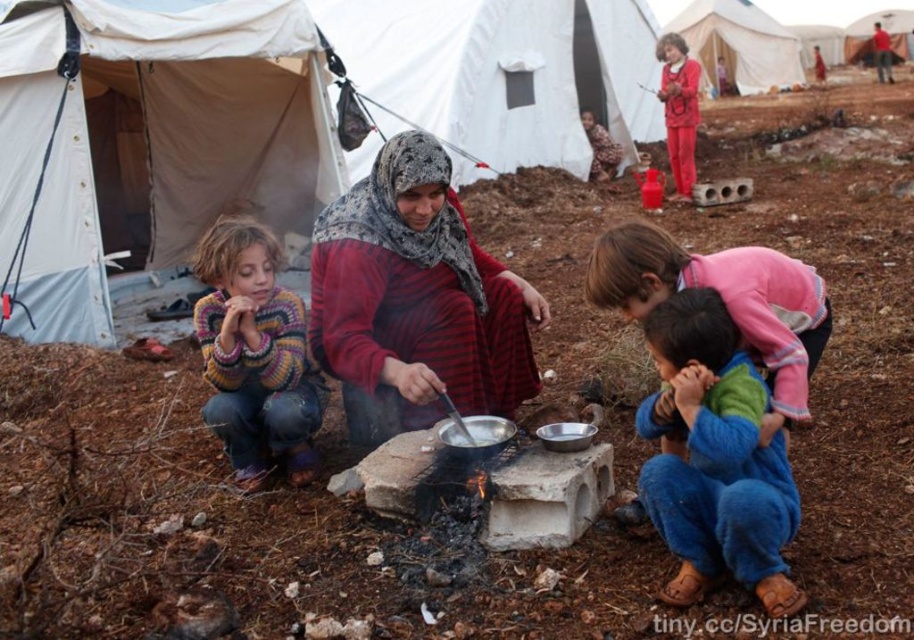
Question: Which point is closer to the camera?

Choices:
 (A) blue denim pants at lower right
 (B) white canvas tent at center
 (C) red striped fabric at center

Answer: (A)

Question: Does white canvas tent at upper center come in front of white fabric tent at upper center?

Choices:
 (A) yes
 (B) no

Answer: (A)

Question: In this image, where is white canvas tent at upper center located relative to white canvas tent at upper right?

Choices:
 (A) left
 (B) right

Answer: (A)

Question: Which is nearer to the multicolored knitted sweater at lower left?

Choices:
 (A) white fabric tent at upper center
 (B) brown textured blanket at upper center

Answer: (B)

Question: Can you confirm if white canvas tent at center is thinner than brown textured blanket at upper center?

Choices:
 (A) no
 (B) yes

Answer: (A)

Question: Which object appears closest to the camera in this image?

Choices:
 (A) multicolored knitted sweater at lower left
 (B) white canvas tent at upper center
 (C) white canvas tent at center

Answer: (A)